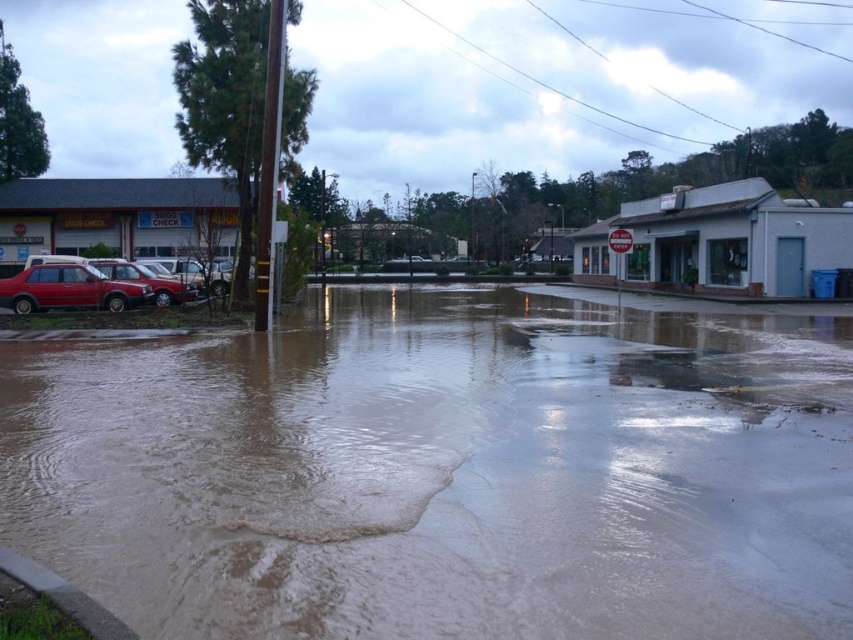
Question: Is matte red car at left above matte red car at lower left?

Choices:
 (A) no
 (B) yes

Answer: (A)

Question: Which of these objects is positioned closest to the matte red car at lower left?

Choices:
 (A) brown muddy water at center
 (B) matte red car at left

Answer: (B)

Question: Does matte red car at left appear under matte red car at lower left?

Choices:
 (A) yes
 (B) no

Answer: (A)

Question: Estimate the real-world distances between objects in this image. Which object is farther from the brown muddy water at center?

Choices:
 (A) matte red car at lower left
 (B) matte red car at left

Answer: (B)

Question: Based on their relative distances, which object is nearer to the brown muddy water at center?

Choices:
 (A) matte red car at lower left
 (B) matte red car at left

Answer: (A)

Question: Does brown muddy water at center appear on the left side of matte red car at lower left?

Choices:
 (A) no
 (B) yes

Answer: (A)